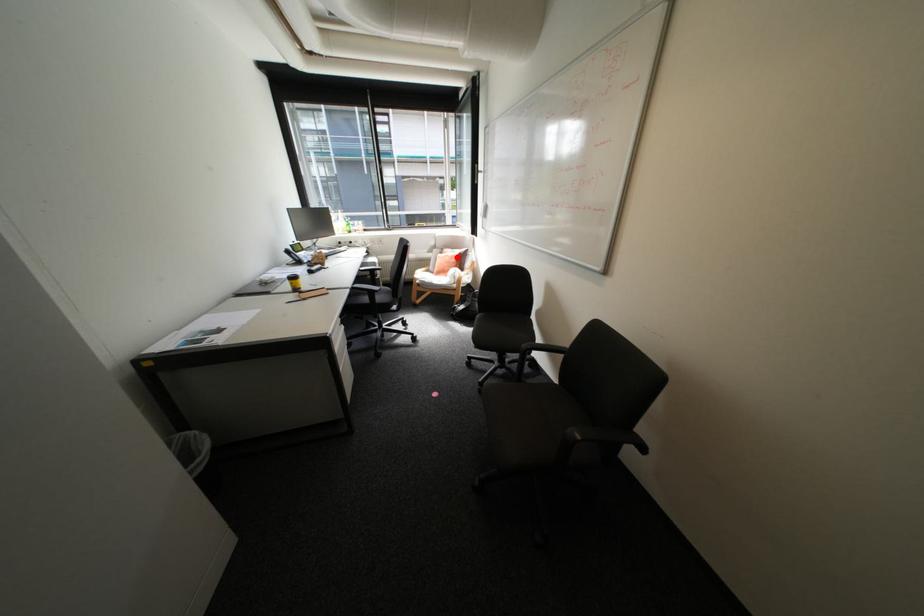
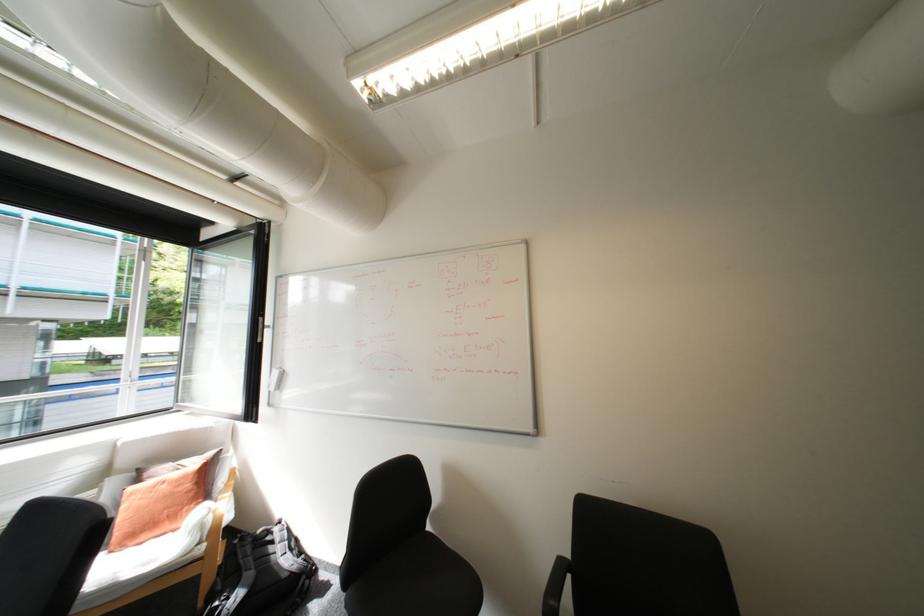
Question: I am providing you with two images of the same scene from different viewpoints. A red point is marked on the first image. At the location where the point appears in image 1, is it still visible in image 2?

Choices:
 (A) Yes
 (B) No

Answer: (A)